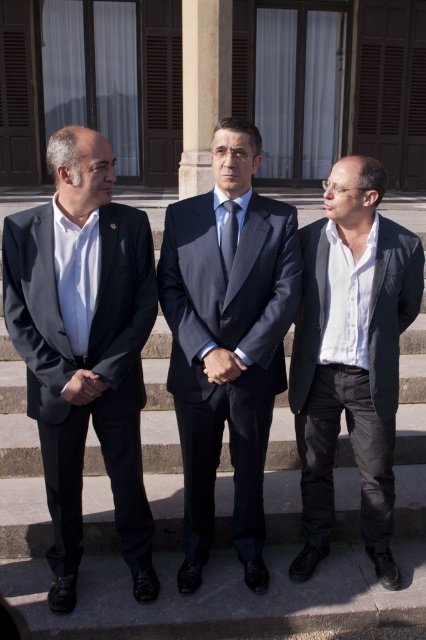
Question: Does matte black suit at left have a greater width compared to blue silk tie at center?

Choices:
 (A) yes
 (B) no

Answer: (A)

Question: Which point is farther to the camera?

Choices:
 (A) dark gray suit at center
 (B) gray concrete stairs at center
 (C) matte black suit at left
 (D) matte black suit at right

Answer: (B)

Question: Is matte black suit at right above blue silk tie at center?

Choices:
 (A) no
 (B) yes

Answer: (A)

Question: Can you confirm if matte black suit at right is positioned below blue silk tie at center?

Choices:
 (A) no
 (B) yes

Answer: (B)

Question: Which of the following is the farthest from the observer?

Choices:
 (A) matte black suit at left
 (B) dark gray suit at center
 (C) gray concrete stairs at center
 (D) blue silk tie at center

Answer: (C)

Question: Which point appears closest to the camera in this image?

Choices:
 (A) (230, 237)
 (B) (34, 532)
 (C) (386, 536)
 (D) (262, 525)

Answer: (A)